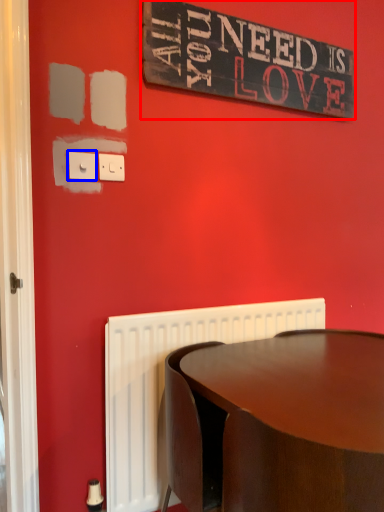
Question: Among these objects, which one is farthest to the camera, bulletin board (highlighted by a red box) or electric outlet (highlighted by a blue box)?

Choices:
 (A) bulletin board
 (B) electric outlet

Answer: (A)